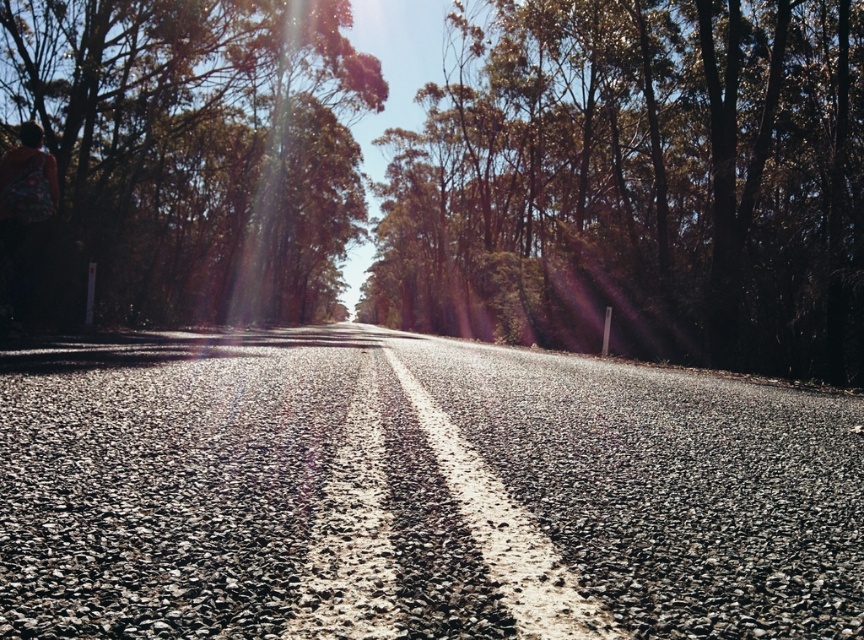
Question: Does green leafy trees at center appear over green leafy tree at left?

Choices:
 (A) no
 (B) yes

Answer: (B)

Question: Is green leafy trees at center to the right of green leafy tree at left from the viewer's perspective?

Choices:
 (A) no
 (B) yes

Answer: (B)

Question: Does green leafy trees at center appear on the right side of green leafy tree at left?

Choices:
 (A) no
 (B) yes

Answer: (B)

Question: Which of the following is the farthest from the observer?

Choices:
 (A) (842, 125)
 (B) (271, 60)

Answer: (B)

Question: Among these points, which one is farthest from the camera?

Choices:
 (A) (335, 113)
 (B) (424, 132)

Answer: (B)